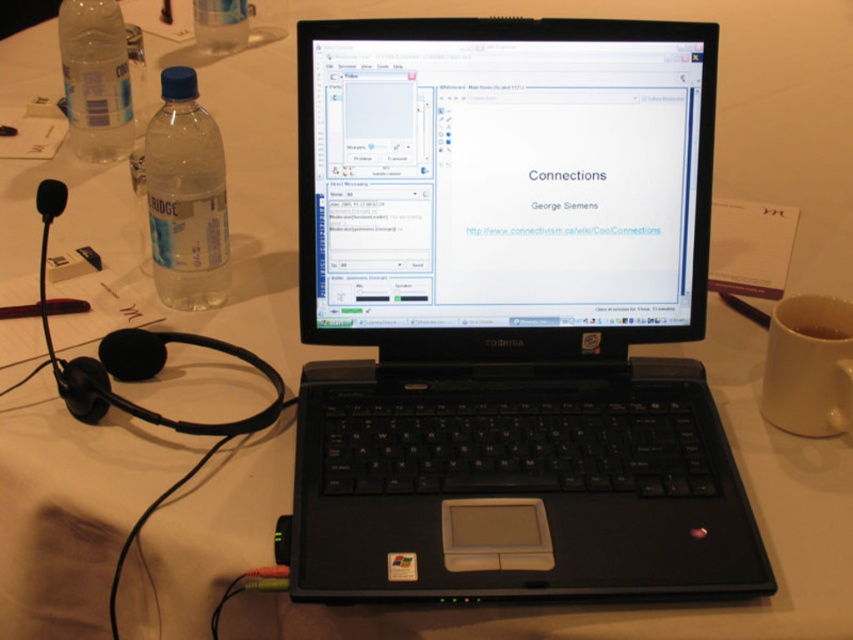
Question: Does black plastic laptop at center appear under clear plastic bottle at left?

Choices:
 (A) yes
 (B) no

Answer: (A)

Question: Which of the following is the farthest from the observer?

Choices:
 (A) clear plastic bottle at upper left
 (B) clear plastic bottle at left

Answer: (A)

Question: Does clear plastic bottle at left have a lesser width compared to clear plastic bottle at upper left?

Choices:
 (A) no
 (B) yes

Answer: (A)

Question: Which point is closer to the camera?

Choices:
 (A) (161, 275)
 (B) (105, 145)
 (C) (726, 477)

Answer: (C)

Question: Considering the real-world distances, which object is closest to the clear plastic bottle at upper left?

Choices:
 (A) clear plastic bottle at left
 (B) black plastic laptop at center

Answer: (A)

Question: Is black plastic laptop at center smaller than clear plastic bottle at upper left?

Choices:
 (A) no
 (B) yes

Answer: (A)